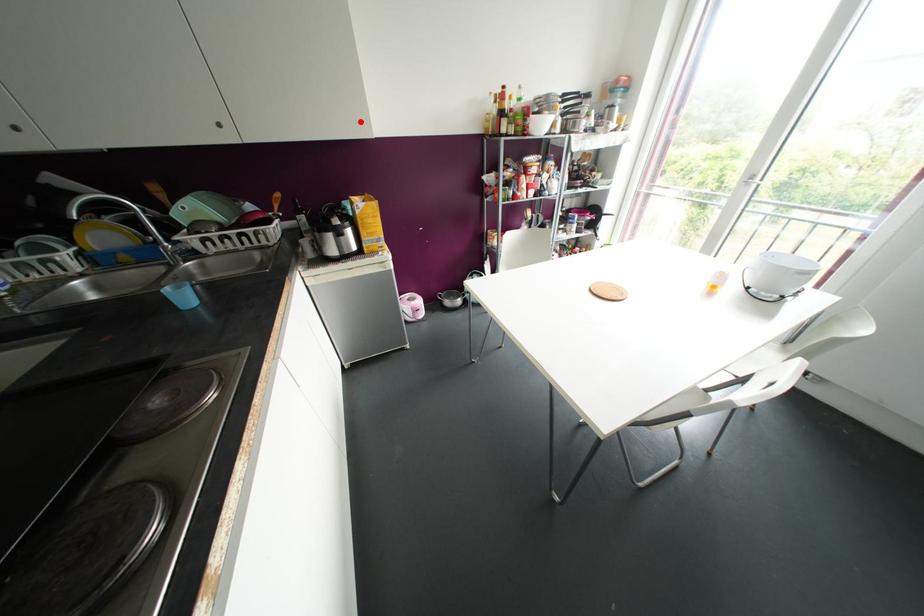
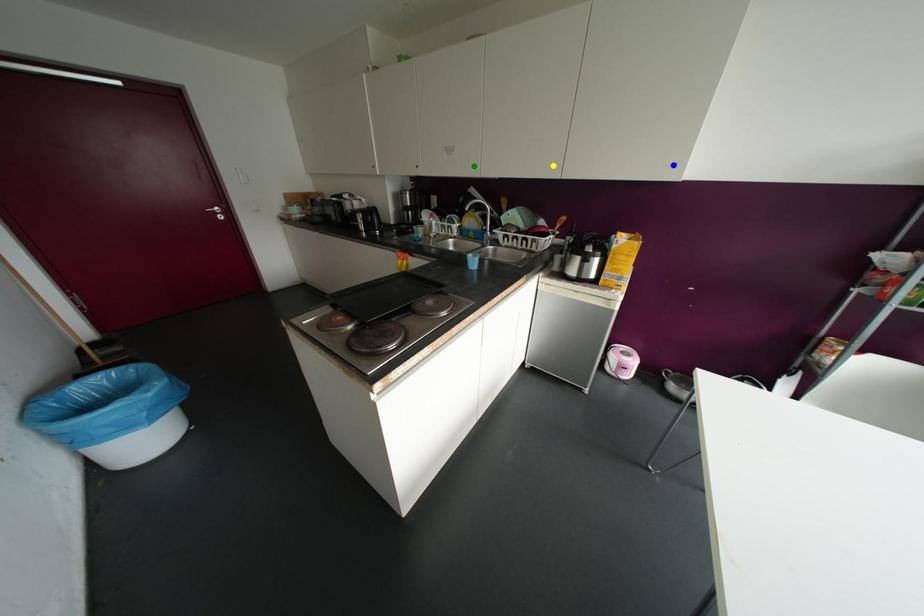
Question: I am providing you with two images of the same scene from different viewpoints. A red point is marked on the first image. You are given multiple points on the second image. Which point in image 2 is actually the same real-world point as the red point in image 1?

Choices:
 (A) yellow point
 (B) blue point
 (C) green point

Answer: (B)